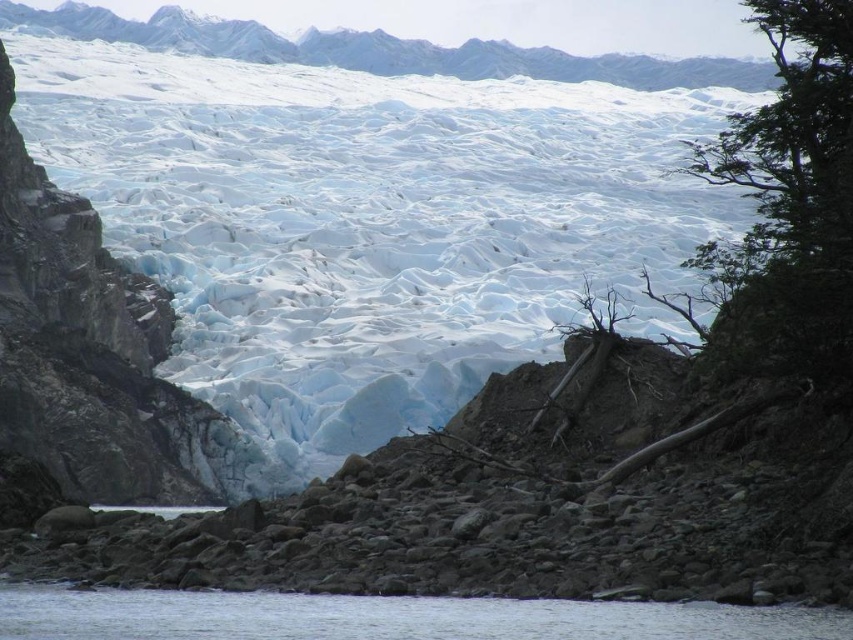
You are standing at the rocky shoreline in the glacier image and see two points marked on the image. The first point is at coordinates point [146,600] and the second point is at point [625,68]. Which point is closer to you?

Point [146,600] is in front of point [625,68], so it is closer to you.

Based on the photo, you are a researcher studying the glacier and need to collect water samples. You have a device that can only reach up to 1 meter from your current position. If you are standing at point A, which is at coordinates 0.966, 0.455, can you reach the clear water at lower center to collect a sample?

The clear water at lower center is located at point (387,618), so yes, you can reach it with your device since it is exactly at your current position.